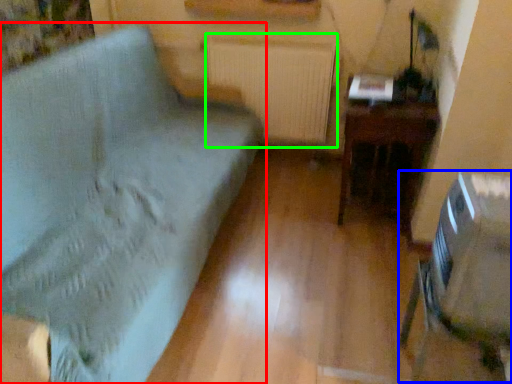
Question: Considering the real-world distances, which object is farthest from furniture (highlighted by a red box)? swivel chair (highlighted by a blue box) or radiator (highlighted by a green box)?

Choices:
 (A) swivel chair
 (B) radiator

Answer: (A)